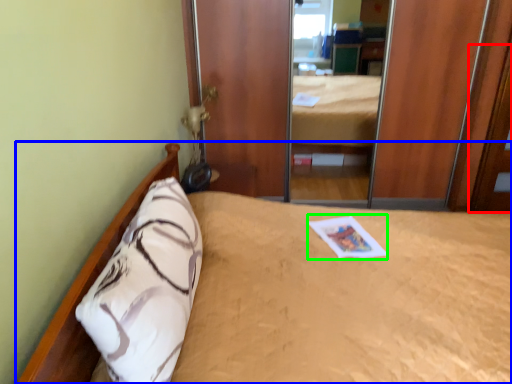
Question: Which object is the farthest from door (highlighted by a red box)? Choose among these: bed (highlighted by a blue box) or magazine (highlighted by a green box).

Choices:
 (A) bed
 (B) magazine

Answer: (A)